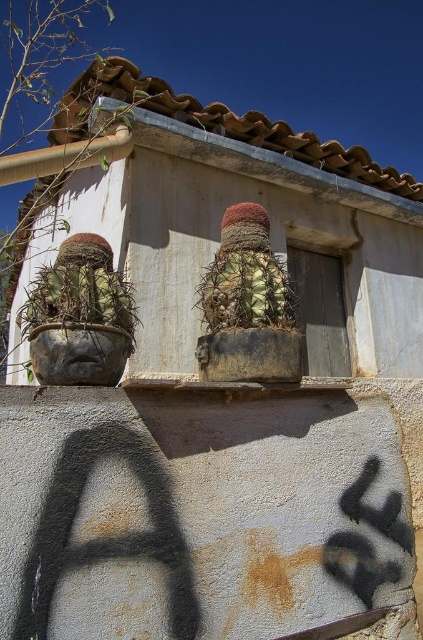
Consider the image. Can you confirm if rusty metal cactus at left is positioned above green textured cactus at center?

No.

Who is lower down, rusty metal cactus at left or green textured cactus at center?

Positioned lower is rusty metal cactus at left.

Does point (71, 372) come in front of point (236, 236)?

Yes, point (71, 372) is in front of point (236, 236).

Find the location of a particular element. rusty metal cactus at left is located at coordinates (79, 316).